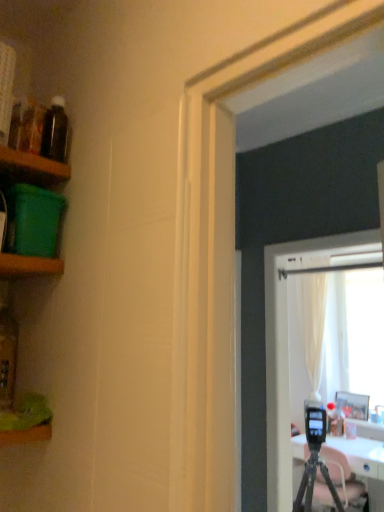
Question: From the image's perspective, does translucent glass bottle at left, placed as the first bottle when sorted from left to right, appear lower than green plastic container at left, which appears as the second shelf when viewed from the top?

Choices:
 (A) yes
 (B) no

Answer: (A)

Question: Can you confirm if translucent glass bottle at left, which is counted as the second bottle, starting from the top, is thinner than green plastic container at left, which appears as the second shelf when viewed from the top?

Choices:
 (A) no
 (B) yes

Answer: (B)

Question: From a real-world perspective, is translucent glass bottle at left, placed as the first bottle when sorted from left to right, beneath green plastic container at left, which appears as the second shelf when viewed from the top?

Choices:
 (A) no
 (B) yes

Answer: (B)

Question: Does translucent glass bottle at left, placed as the first bottle when sorted from left to right, come behind green plastic container at left, which appears as the second shelf when viewed from the top?

Choices:
 (A) yes
 (B) no

Answer: (A)

Question: Does translucent glass bottle at left, placed as the first bottle when sorted from left to right, have a lesser height compared to green plastic container at left, marked as the 2th shelf in a bottom-to-top arrangement?

Choices:
 (A) no
 (B) yes

Answer: (A)

Question: Is translucent glass bottle at left, placed as the first bottle when sorted from left to right, facing towards green plastic container at left, marked as the 2th shelf in a bottom-to-top arrangement?

Choices:
 (A) no
 (B) yes

Answer: (A)

Question: Is wooden picture frame at right closer to camera compared to green plastic container at left, marked as the 2th shelf in a bottom-to-top arrangement?

Choices:
 (A) no
 (B) yes

Answer: (A)

Question: Is the surface of wooden picture frame at right in direct contact with green plastic container at left, which appears as the second shelf when viewed from the top?

Choices:
 (A) no
 (B) yes

Answer: (A)

Question: Is wooden picture frame at right taller than green plastic container at left, marked as the 2th shelf in a bottom-to-top arrangement?

Choices:
 (A) yes
 (B) no

Answer: (A)

Question: Is the depth of wooden picture frame at right greater than that of green plastic container at left, which appears as the second shelf when viewed from the top?

Choices:
 (A) yes
 (B) no

Answer: (A)

Question: Considering the relative sizes of wooden picture frame at right and green plastic container at left, marked as the 2th shelf in a bottom-to-top arrangement, in the image provided, is wooden picture frame at right smaller than green plastic container at left, marked as the 2th shelf in a bottom-to-top arrangement,?

Choices:
 (A) yes
 (B) no

Answer: (B)

Question: Is wooden picture frame at right shorter than green plastic container at left, which appears as the second shelf when viewed from the top?

Choices:
 (A) no
 (B) yes

Answer: (A)

Question: Is the position of green plastic container at left, marked as the 2th shelf in a bottom-to-top arrangement, less distant than that of green plastic container at left, which ranks as the third shelf in bottom-to-top order?

Choices:
 (A) no
 (B) yes

Answer: (A)